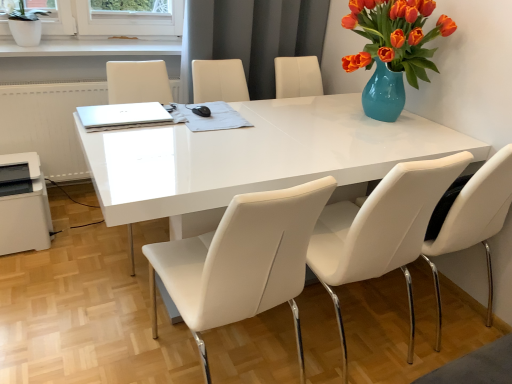
Locate an element on the screen. This screenshot has width=512, height=384. vacant space in white leather chair at right, placed as the third chair when sorted from left to right (from a real-world perspective) is located at coordinates (429, 315).